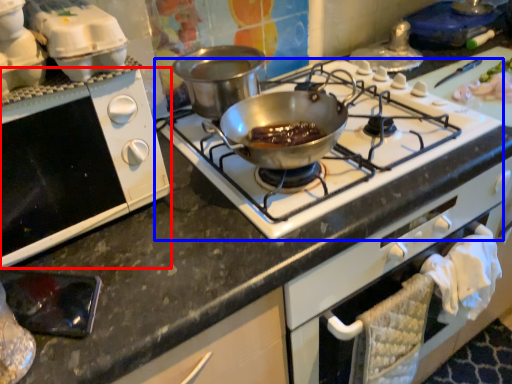
Question: Which object appears closest to the camera in this image, oven (highlighted by a red box) or gas stove (highlighted by a blue box)?

Choices:
 (A) oven
 (B) gas stove

Answer: (A)